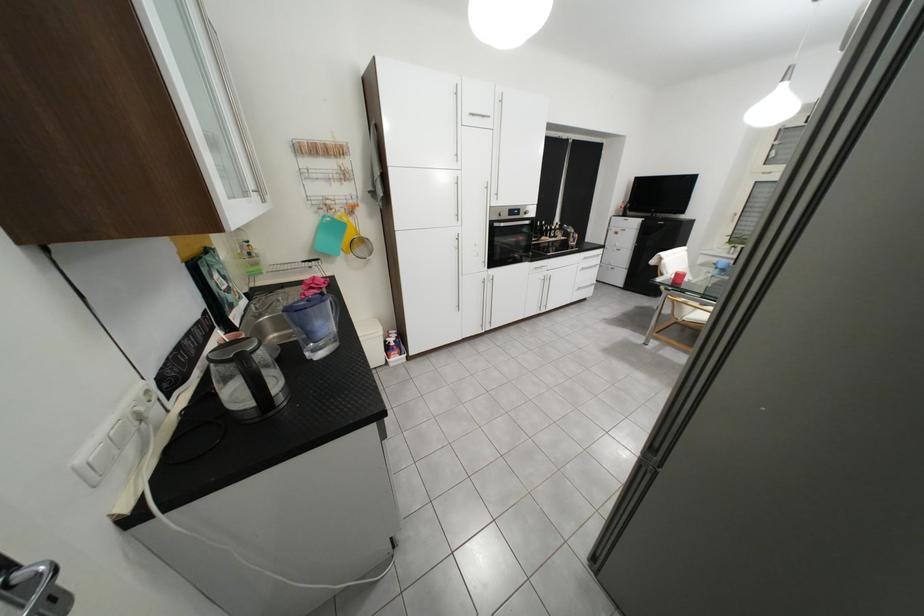
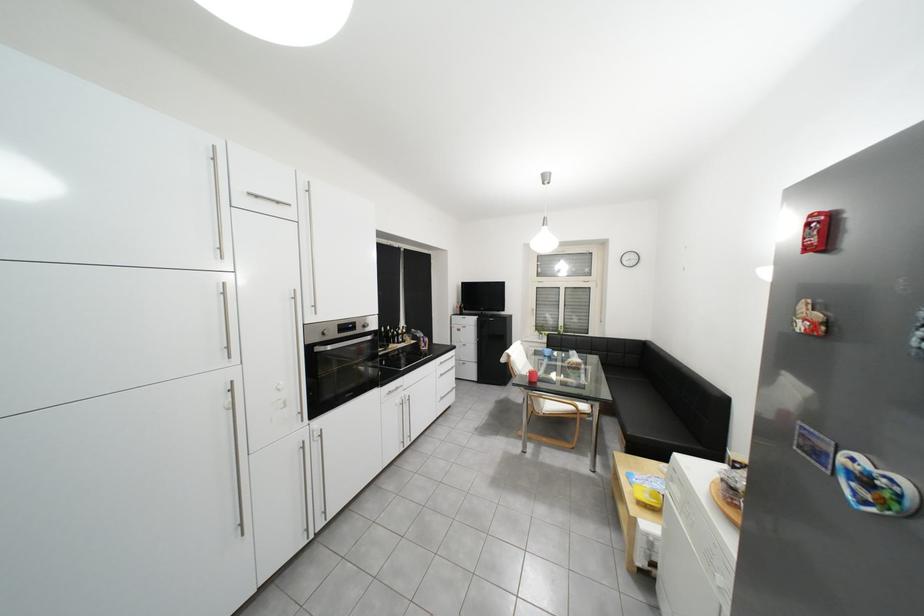
Locate, in the second image, the point that corresponds to [693,310] in the first image.

(551, 403)